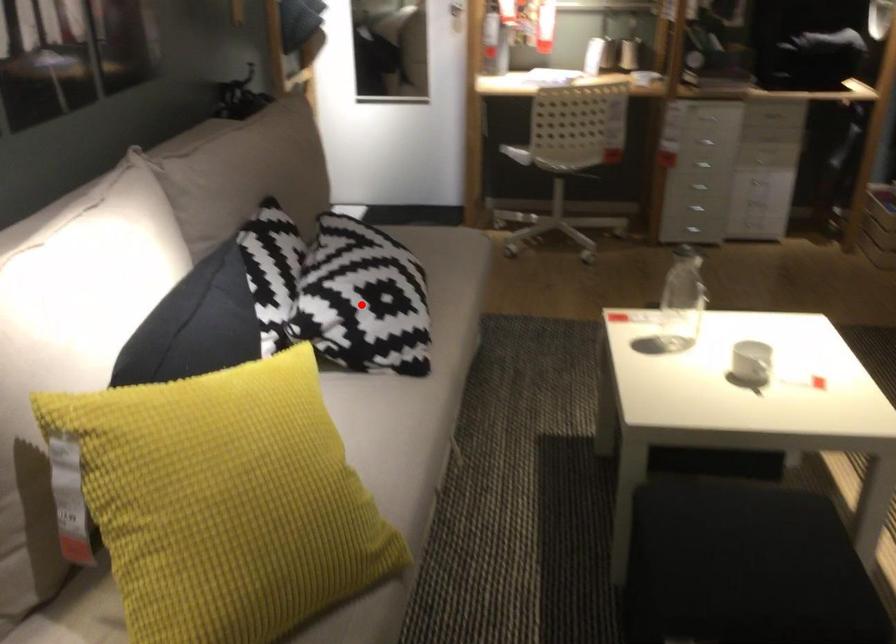
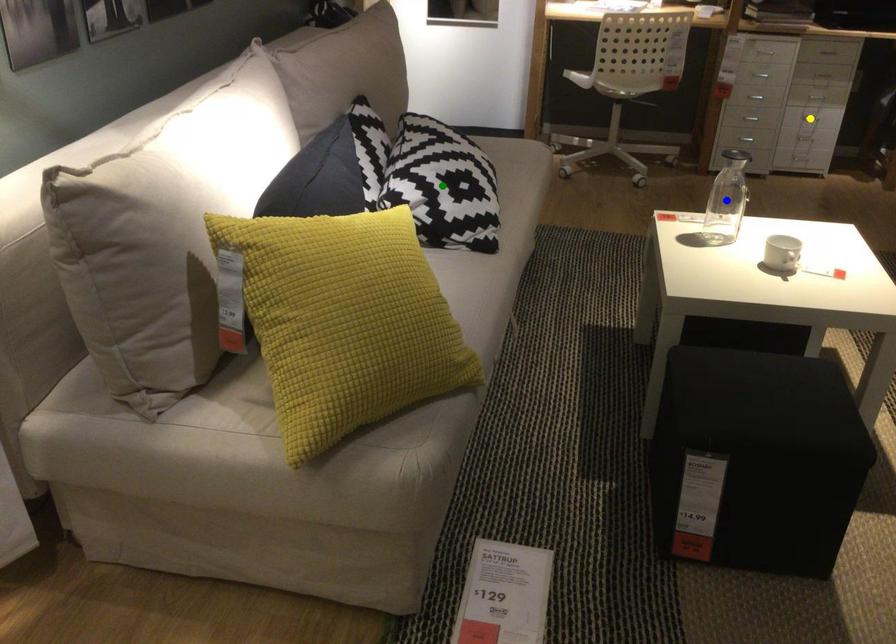
Question: I am providing you with two images of the same scene from different viewpoints. A red point is marked on the first image. You are given multiple points on the second image. Which spot in image 2 lines up with the point in image 1?

Choices:
 (A) green point
 (B) yellow point
 (C) blue point

Answer: (A)